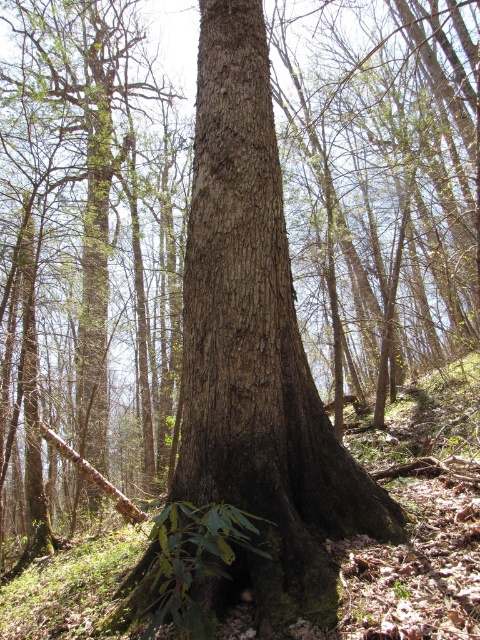
Between brown rough tree trunk at center and smooth brown tree trunk at center, which one appears on the right side from the viewer's perspective?

From the viewer's perspective, brown rough tree trunk at center appears more on the right side.

Which is more to the left, brown rough tree trunk at center or smooth brown tree trunk at center?

Positioned to the left is smooth brown tree trunk at center.

Which is in front, point (233, 275) or point (59, 88)?

Point (233, 275)

At what (x,y) coordinates should I click in order to perform the action: click on brown rough tree trunk at center. Please return your answer as a coordinate pair (x, y). This screenshot has width=480, height=640. Looking at the image, I should click on (256, 349).